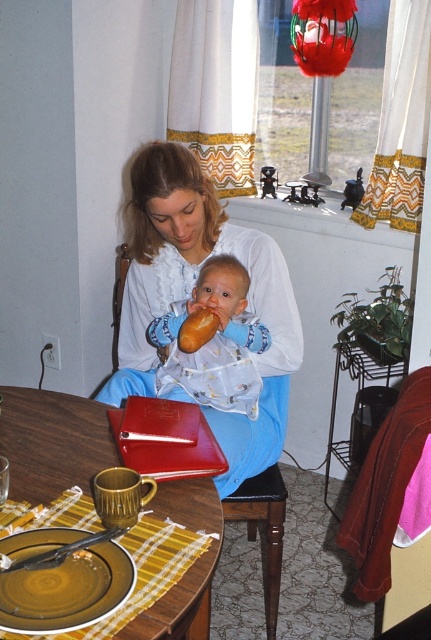
Question: Is matte white blouse at center smaller than blue fabric chair at center?

Choices:
 (A) no
 (B) yes

Answer: (A)

Question: Is soft blue fabric at center to the right of matte brown bread at center from the viewer's perspective?

Choices:
 (A) yes
 (B) no

Answer: (A)

Question: Which of the following is the farthest from the observer?

Choices:
 (A) yellow fabric placemat at lower left
 (B) blue fabric chair at center
 (C) soft blue fabric at center
 (D) matte white blouse at center

Answer: (B)

Question: Among these objects, which one is farthest from the camera?

Choices:
 (A) soft blue fabric at center
 (B) matte brown bread at center
 (C) yellow fabric placemat at lower left

Answer: (A)

Question: Is yellow fabric placemat at lower left bigger than matte brown bread at center?

Choices:
 (A) yes
 (B) no

Answer: (A)

Question: Which object appears farthest from the camera in this image?

Choices:
 (A) yellow fabric placemat at lower left
 (B) blue fabric chair at center

Answer: (B)